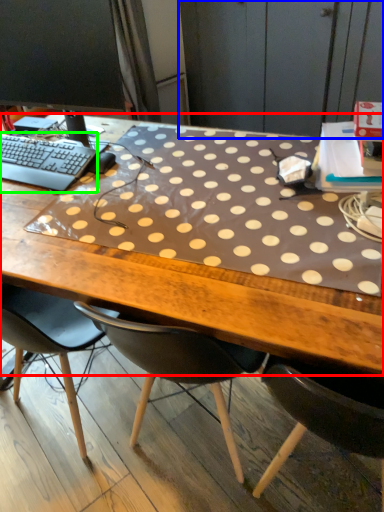
Question: Which object is the closest to the desk (highlighted by a red box)? Choose among these: dresser (highlighted by a blue box) or computer keyboard (highlighted by a green box).

Choices:
 (A) dresser
 (B) computer keyboard

Answer: (B)